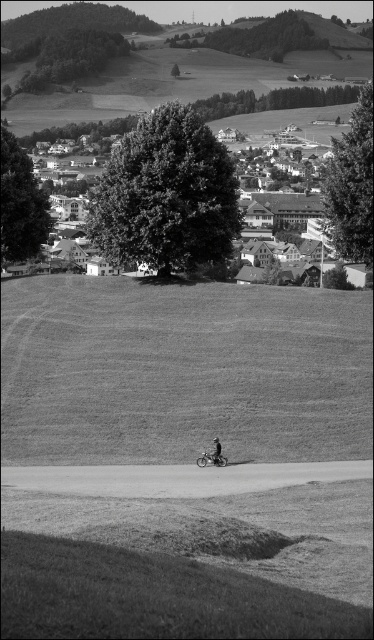
Which is more to the right, grassy field at center or black matte bicycle at center?

black matte bicycle at center is more to the right.

Between grassy field at center and black matte bicycle at center, which one is positioned higher?

grassy field at center is above.

Between point (243, 436) and point (215, 452), which one is positioned in front?

Point (215, 452)

What are the coordinates of `grassy field at center` in the screenshot? It's located at (182, 371).

Between point (289, 326) and point (200, 456), which one is positioned in front?

Point (200, 456)

Who is positioned more to the left, grassy field at center or metallic silver motorcycle at center?

Positioned to the left is grassy field at center.

Locate an element on the screen. grassy field at center is located at coordinates (182, 371).

Does grassy field at center have a greater height compared to dirt/gravel path at center?

Yes.

Is grassy field at center positioned at the back of dirt/gravel path at center?

Yes, grassy field at center is further from the viewer.

Does point (136, 314) lie in front of point (93, 496)?

No, (136, 314) is further to viewer.

Where is `grassy field at center`? The height and width of the screenshot is (640, 374). grassy field at center is located at coordinates (182, 371).